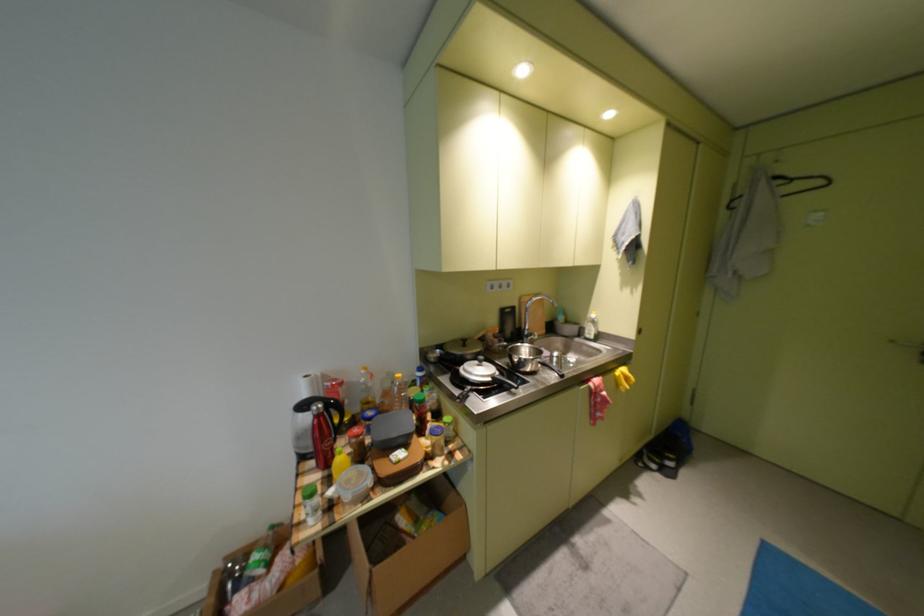
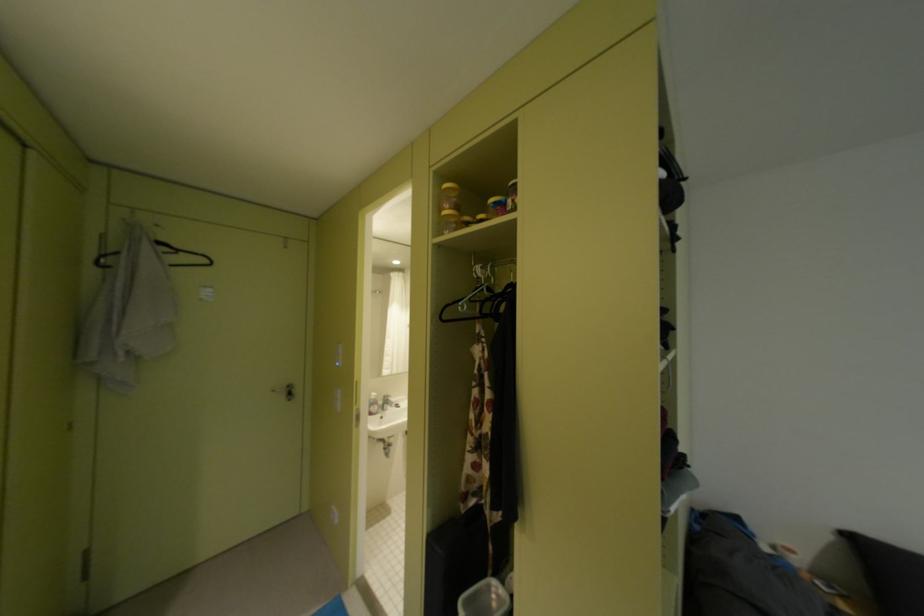
Question: The camera is either moving clockwise (left) or counter-clockwise (right) around the object. The first image is from the beginning of the video and the second image is from the end. Is the camera moving left or right when shooting the video?

Choices:
 (A) Left
 (B) Right

Answer: (A)